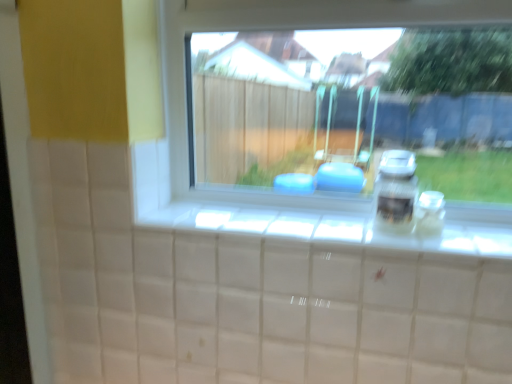
Question: Based on their sizes in the image, would you say satin silver jar at right is bigger or smaller than transparent glass window at center?

Choices:
 (A) big
 (B) small

Answer: (B)

Question: From the image's perspective, is satin silver jar at right positioned above or below transparent glass window at center?

Choices:
 (A) above
 (B) below

Answer: (B)

Question: Based on their relative distances, which object is farther from the satin silver jar at right?

Choices:
 (A) transparent glass window at center
 (B) transparent glass jar at right

Answer: (A)

Question: Estimate the real-world distances between objects in this image. Which object is farther from the transparent glass jar at right?

Choices:
 (A) satin silver jar at right
 (B) transparent glass window at center

Answer: (B)